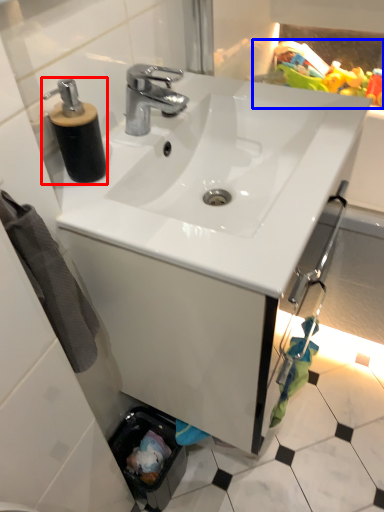
Question: Among these objects, which one is nearest to the camera, soap dispenser (highlighted by a red box) or toy (highlighted by a blue box)?

Choices:
 (A) soap dispenser
 (B) toy

Answer: (A)